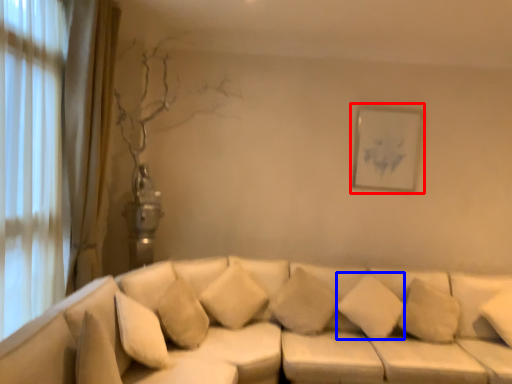
Question: Among these objects, which one is nearest to the camera, picture frame (highlighted by a red box) or pillow (highlighted by a blue box)?

Choices:
 (A) picture frame
 (B) pillow

Answer: (B)